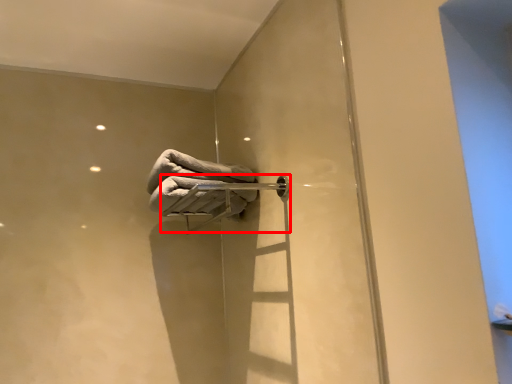
Question: Considering the relative positions of towel bar (annotated by the red box) and towel in the image provided, where is towel bar (annotated by the red box) located with respect to the staircase?

Choices:
 (A) right
 (B) left

Answer: (A)